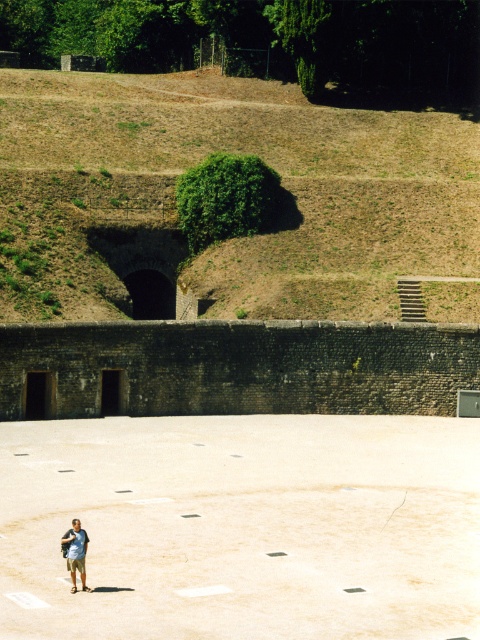
Is smooth concrete skate park at center shorter than brown earthy hillside at upper center?

Correct, smooth concrete skate park at center is not as tall as brown earthy hillside at upper center.

Does smooth concrete skate park at center have a larger size compared to brown earthy hillside at upper center?

Actually, smooth concrete skate park at center might be smaller than brown earthy hillside at upper center.

Is point (110, 564) farther from camera compared to point (162, 260)?

No, (110, 564) is closer to viewer.

In order to click on smooth concrete skate park at center in this screenshot , I will do `click(242, 528)`.

Is point (371, 150) less distant than point (74, 529)?

No, (371, 150) is further to viewer.

Is brown earthy hillside at upper center below light blue cotton shirt at lower left?

No.

I want to click on brown earthy hillside at upper center, so click(196, 163).

Where is `brown earthy hillside at upper center`? brown earthy hillside at upper center is located at coordinates (196, 163).

Is smooth concrete skate park at center to the left of light blue cotton shirt at lower left from the viewer's perspective?

Incorrect, smooth concrete skate park at center is not on the left side of light blue cotton shirt at lower left.

At what (x,y) coordinates should I click in order to perform the action: click on smooth concrete skate park at center. Please return your answer as a coordinate pair (x, y). Looking at the image, I should click on (242, 528).

Describe the element at coordinates (242, 528) in the screenshot. I see `smooth concrete skate park at center` at that location.

The height and width of the screenshot is (640, 480). I want to click on smooth concrete skate park at center, so click(x=242, y=528).